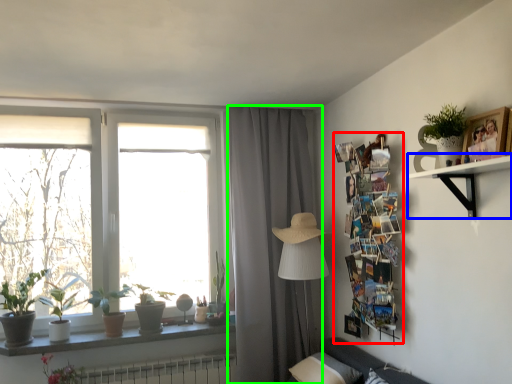
Question: Based on their relative distances, which object is nearer to bulletin board (highlighted by a red box)? Choose from shelf (highlighted by a blue box) and curtain (highlighted by a green box).

Choices:
 (A) shelf
 (B) curtain

Answer: (A)